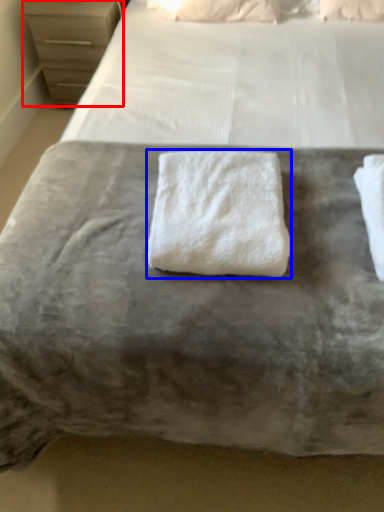
Question: Which of the following is the farthest to the observer, chest of drawers (highlighted by a red box) or towel (highlighted by a blue box)?

Choices:
 (A) chest of drawers
 (B) towel

Answer: (A)